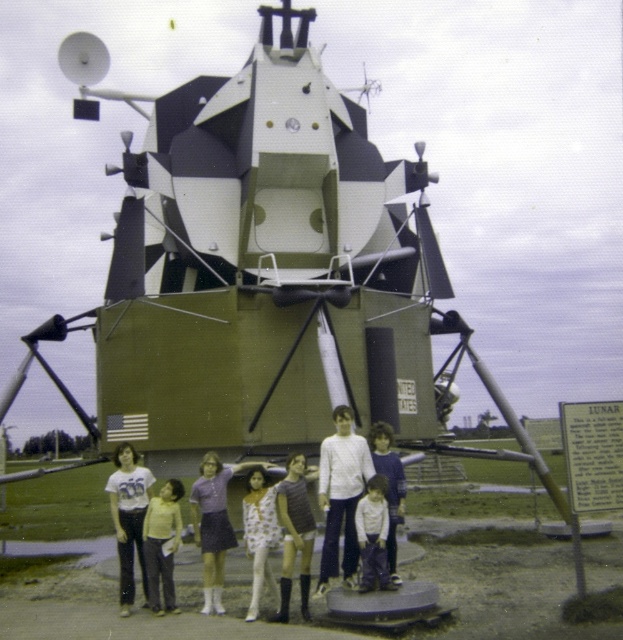
From the picture: You are standing at the base of the lunar module model and notice a point marked at coordinates (295, 531). What object is located at that specific point?

The white textured dress at center is located at point (295, 531).

Looking at this image, you are a photographer taking a picture of the light brown fabric dress at center and the white floral dress at center. Which dress should you focus on first if you want to capture both in the frame without moving the camera?

The light brown fabric dress at center is bigger than the white floral dress at center, so you should focus on the light brown fabric dress at center first to ensure it fits properly in the frame.

You are a photographer taking a picture of the group in front of the lunar module model. You notice the white textured dress at center and the light brown hair at center. Which object should you focus on first to ensure both are in frame?

The white textured dress at center is positioned on the left side of light brown hair at center, so you should focus on the white textured dress at center first to ensure both are in frame.